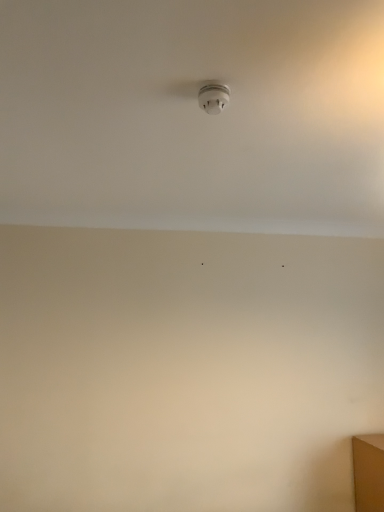
Question: Is white matte ceiling at center to the left or to the right of white plastic smoke detector at upper center in the image?

Choices:
 (A) right
 (B) left

Answer: (A)

Question: From the image's perspective, is white matte ceiling at center positioned above or below white plastic smoke detector at upper center?

Choices:
 (A) below
 (B) above

Answer: (A)

Question: Considering the positions of white matte ceiling at center and white plastic smoke detector at upper center in the image, is white matte ceiling at center taller or shorter than white plastic smoke detector at upper center?

Choices:
 (A) short
 (B) tall

Answer: (B)

Question: Based on their sizes in the image, would you say white plastic smoke detector at upper center is bigger or smaller than white matte ceiling at center?

Choices:
 (A) big
 (B) small

Answer: (B)

Question: Is white plastic smoke detector at upper center to the left or to the right of white matte ceiling at center in the image?

Choices:
 (A) left
 (B) right

Answer: (A)

Question: From a real-world perspective, relative to white matte ceiling at center, is white plastic smoke detector at upper center vertically above or below?

Choices:
 (A) below
 (B) above

Answer: (A)

Question: From their relative heights in the image, would you say white plastic smoke detector at upper center is taller or shorter than white matte ceiling at center?

Choices:
 (A) tall
 (B) short

Answer: (B)